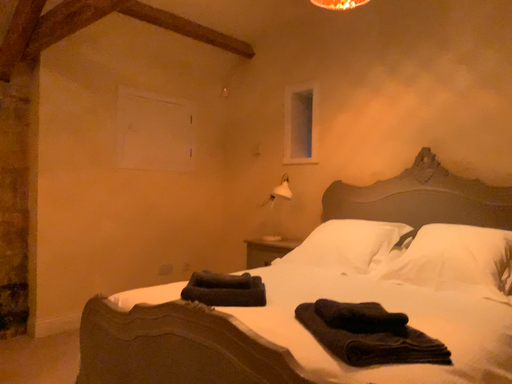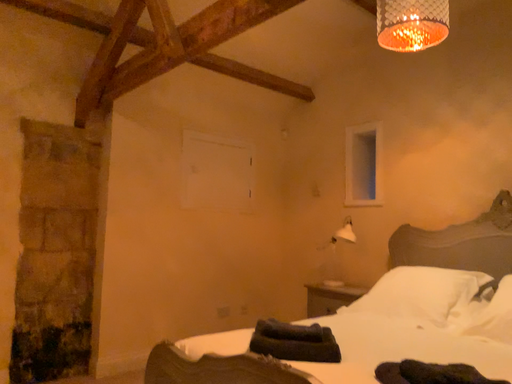
Question: How did the camera likely rotate when shooting the video?

Choices:
 (A) rotated right
 (B) rotated left

Answer: (B)